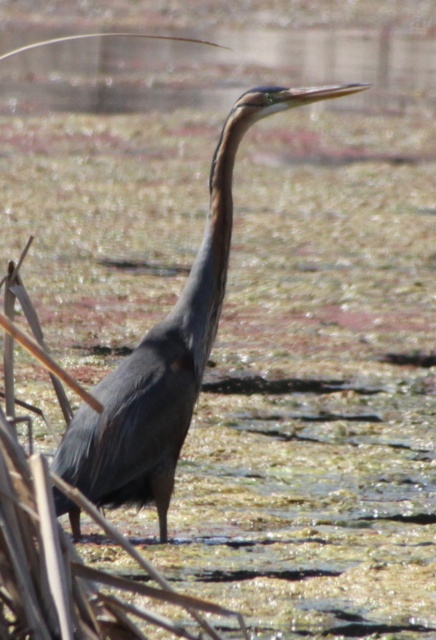
Question: Can you confirm if shiny dark blue heron at center is wider than shiny purple neck at center?

Choices:
 (A) yes
 (B) no

Answer: (A)

Question: Which of the following is the closest to the observer?

Choices:
 (A) (215, 269)
 (B) (224, 202)

Answer: (B)

Question: Which point is farther from the camera taking this photo?

Choices:
 (A) (203, 304)
 (B) (180, 442)

Answer: (A)

Question: Is shiny dark blue heron at center thinner than shiny purple neck at center?

Choices:
 (A) no
 (B) yes

Answer: (A)

Question: Is shiny dark blue heron at center to the right of shiny purple neck at center from the viewer's perspective?

Choices:
 (A) no
 (B) yes

Answer: (A)